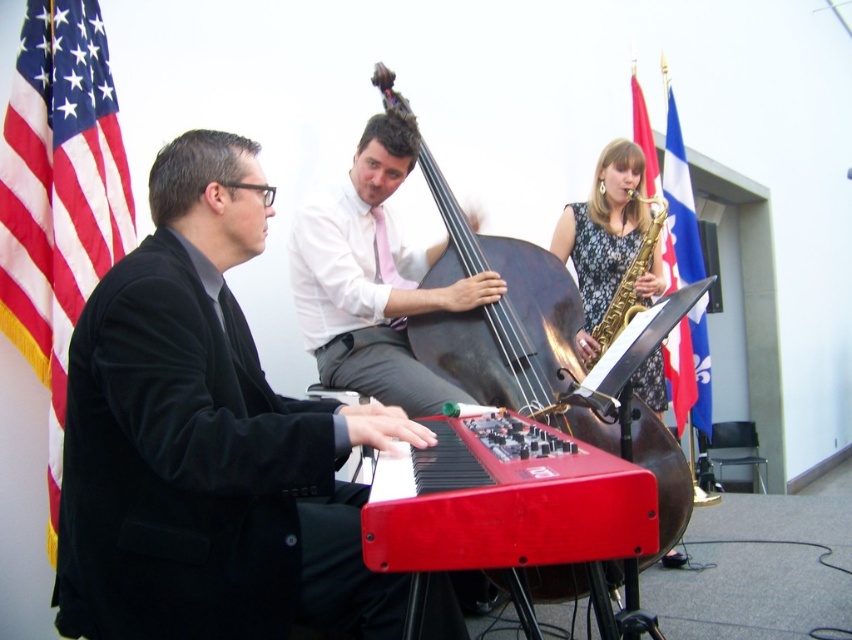
Question: Is floral dress at upper center thinner than blue fabric flag at upper right?

Choices:
 (A) no
 (B) yes

Answer: (A)

Question: Among these objects, which one is nearest to the camera?

Choices:
 (A) american flag at left
 (B) floral dress at upper center

Answer: (A)

Question: Which of these objects is positioned closest to the black fabric suit at left?

Choices:
 (A) american flag at left
 (B) floral dress at upper center
 (C) pink silk tie at center
 (D) shiny black cello at center

Answer: (A)

Question: Does shiny black cello at center appear on the right side of pink silk tie at center?

Choices:
 (A) no
 (B) yes

Answer: (B)

Question: Which of the following is the closest to the observer?

Choices:
 (A) american flag at left
 (B) floral dress at upper center
 (C) pink silk tie at center

Answer: (A)

Question: Is american flag at left above shiny red keyboard at center?

Choices:
 (A) no
 (B) yes

Answer: (B)